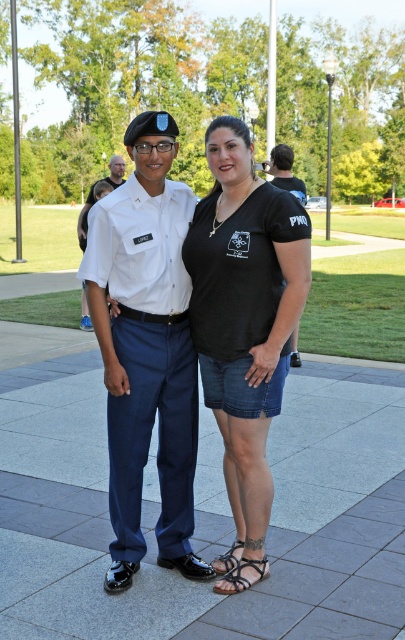
Question: Which point is farther to the camera?

Choices:
 (A) black leather sandal at lower center
 (B) matte blue pants at center
 (C) white uniform at center
 (D) matte white uniform at center

Answer: (C)

Question: Is matte blue pants at center wider than black leather sandal at lower center?

Choices:
 (A) yes
 (B) no

Answer: (A)

Question: Can you confirm if matte blue pants at center is thinner than black leather sandal at lower center?

Choices:
 (A) no
 (B) yes

Answer: (A)

Question: Which object is farther from the camera taking this photo?

Choices:
 (A) white uniform at center
 (B) matte blue pants at center

Answer: (A)

Question: Can you confirm if white uniform at center is positioned below black leather sandal at lower center?

Choices:
 (A) yes
 (B) no

Answer: (B)

Question: Among these objects, which one is farthest from the camera?

Choices:
 (A) white uniform at center
 (B) black leather sandal at lower center

Answer: (A)